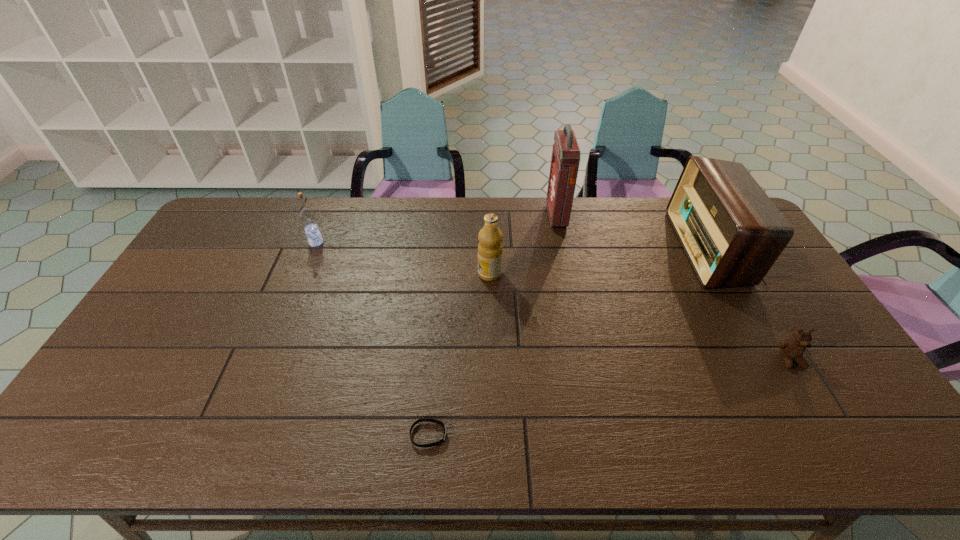
The image size is (960, 540). What are the coordinates of `the fourth object from left to right` in the screenshot? It's located at (565, 160).

Where is `the tallest object`? the tallest object is located at coordinates (565, 160).

In order to click on radio receiver in this screenshot , I will do `click(732, 233)`.

What are the coordinates of `olive oil` in the screenshot? It's located at (490, 249).

Identify the location of the leftmost object. Image resolution: width=960 pixels, height=540 pixels. (307, 216).

The width and height of the screenshot is (960, 540). Find the location of `the fifth farthest object`. the fifth farthest object is located at coordinates (792, 349).

Identify the location of teddy bear. The height and width of the screenshot is (540, 960). (792, 349).

Where is `the shortest object`? The width and height of the screenshot is (960, 540). the shortest object is located at coordinates (441, 423).

Identify the location of the fifth object from right to left. (441, 423).

Locate an element on the screen. blank area located 0.200m on the front-facing side of the tallest object is located at coordinates (493, 216).